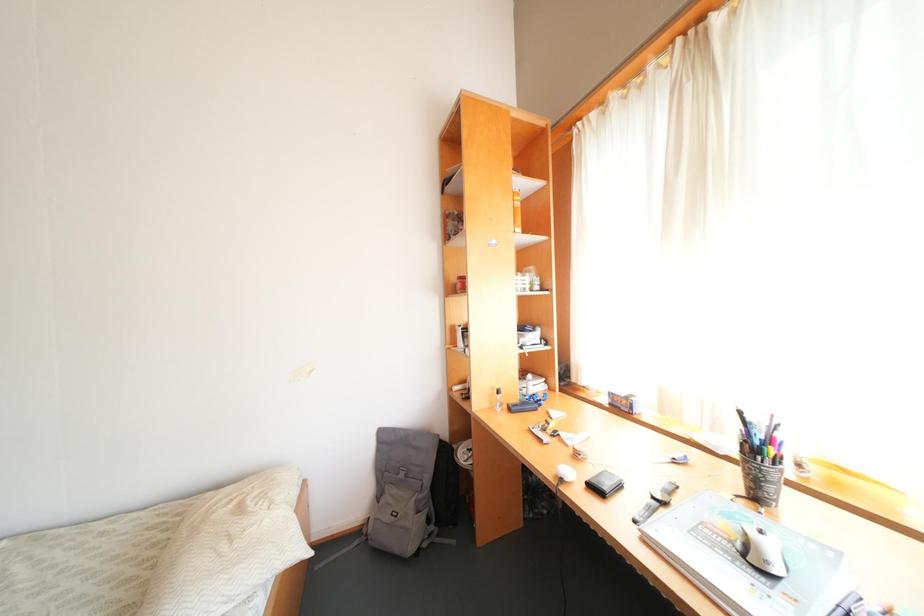
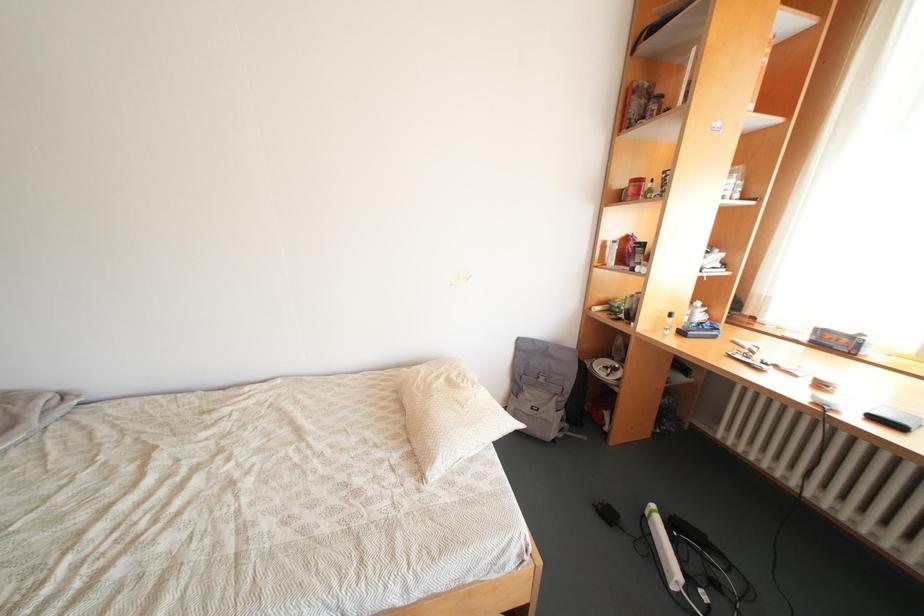
Question: How did the camera likely rotate?

Choices:
 (A) Left
 (B) Right
 (C) Up
 (D) Down

Answer: (D)